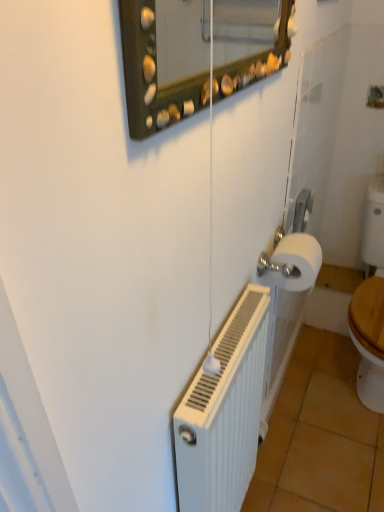
The image size is (384, 512). In order to click on white ribbed radiator at lower right in this screenshot , I will do `click(224, 413)`.

Describe the element at coordinates (224, 413) in the screenshot. I see `white ribbed radiator at lower right` at that location.

Image resolution: width=384 pixels, height=512 pixels. What do you see at coordinates (296, 262) in the screenshot? I see `white matte toilet paper at right` at bounding box center [296, 262].

The width and height of the screenshot is (384, 512). I want to click on white ribbed radiator at lower right, so click(x=224, y=413).

Does point (257, 473) appear closer or farther from the camera than point (269, 281)?

Point (257, 473) is positioned farther from the camera compared to point (269, 281).

From the image's perspective, does orange tile at lower right appear higher than white matte toilet paper at right?

Incorrect, from the image's perspective, orange tile at lower right is lower than white matte toilet paper at right.

Is orange tile at lower right behind white matte toilet paper at right?

Yes, orange tile at lower right is further from the viewer.

Consider the image. Is orange tile at lower right inside or outside of white matte toilet paper at right?

orange tile at lower right cannot be found inside white matte toilet paper at right.

Considering the sizes of objects white matte toilet paper at right and orange tile at lower right in the image provided, who is bigger, white matte toilet paper at right or orange tile at lower right?

With larger size is orange tile at lower right.

Is white matte toilet paper at right aimed at orange tile at lower right?

No, white matte toilet paper at right is not turned towards orange tile at lower right.

Does white matte toilet paper at right have a greater width compared to orange tile at lower right?

No.

From the image's perspective, is white matte toilet paper at right above or below orange tile at lower right?

Based on their image positions, white matte toilet paper at right is located above orange tile at lower right.

Is white ribbed radiator at lower right turned away from white matte toilet paper at right?

No, white ribbed radiator at lower right's orientation is not away from white matte toilet paper at right.

Identify the location of radiator that is under the white matte toilet paper at right (from a real-world perspective). The height and width of the screenshot is (512, 384). (224, 413).

From the image's perspective, is white ribbed radiator at lower right located above white matte toilet paper at right?

No, from the image's perspective, white ribbed radiator at lower right is not on top of white matte toilet paper at right.

Between white ribbed radiator at lower right and white matte toilet paper at right, which one has smaller size?

white matte toilet paper at right is smaller.

Considering the sizes of objects white ribbed radiator at lower right and orange tile at lower right in the image provided, who is thinner, white ribbed radiator at lower right or orange tile at lower right?

white ribbed radiator at lower right.

From a real-world perspective, is white ribbed radiator at lower right physically located above or below orange tile at lower right?

In terms of real-world spatial position, white ribbed radiator at lower right is above orange tile at lower right.

The height and width of the screenshot is (512, 384). In order to click on tile located below the white ribbed radiator at lower right (from the image's perspective) in this screenshot , I will do `click(320, 436)`.

Is white ribbed radiator at lower right outside of orange tile at lower right?

Yes, white ribbed radiator at lower right is located beyond the bounds of orange tile at lower right.

Based on the photo, is orange tile at lower right far from white ribbed radiator at lower right?

They are positioned close to each other.

From the image's perspective, which is below, orange tile at lower right or white ribbed radiator at lower right?

orange tile at lower right, from the image's perspective.

Is point (276, 504) less distant than point (262, 381)?

No, it is behind (262, 381).

Is white matte toilet paper at right turned away from white ribbed radiator at lower right?

No, white ribbed radiator at lower right is not at the back of white matte toilet paper at right.

Locate an element on the screen. The image size is (384, 512). radiator on the left side of white matte toilet paper at right is located at coordinates (224, 413).

Is white matte toilet paper at right to the left of white ribbed radiator at lower right from the viewer's perspective?

Incorrect, white matte toilet paper at right is not on the left side of white ribbed radiator at lower right.

From a real-world perspective, which object stands above the other?

white matte toilet paper at right.

This screenshot has width=384, height=512. What are the coordinates of `tile located underneath the white matte toilet paper at right (from a real-world perspective)` in the screenshot? It's located at (320, 436).

I want to click on toilet paper lying above the orange tile at lower right (from the image's perspective), so pos(296,262).

Which object lies further to the anchor point orange tile at lower right, white matte toilet paper at right or white ribbed radiator at lower right?

Among the two, white matte toilet paper at right is located further to orange tile at lower right.

Looking at the image, which one is located further to white matte toilet paper at right, white ribbed radiator at lower right or orange tile at lower right?

orange tile at lower right.

Which object lies nearer to the anchor point orange tile at lower right, white ribbed radiator at lower right or white matte toilet paper at right?

white ribbed radiator at lower right is positioned closer to the anchor orange tile at lower right.

Estimate the real-world distances between objects in this image. Which object is closer to white ribbed radiator at lower right, orange tile at lower right or white matte toilet paper at right?

Based on the image, white matte toilet paper at right appears to be nearer to white ribbed radiator at lower right.

Estimate the real-world distances between objects in this image. Which object is closer to white matte toilet paper at right, orange tile at lower right or white ribbed radiator at lower right?

white ribbed radiator at lower right is positioned closer to the anchor white matte toilet paper at right.

Which object lies nearer to the anchor point white ribbed radiator at lower right, white matte toilet paper at right or orange tile at lower right?

white matte toilet paper at right is closer to white ribbed radiator at lower right.

You are a GUI agent. You are given a task and a screenshot of the screen. Output one action in this format:
    pyautogui.click(x=<x>, y=<y>)
    Task: Click on the radiator between white matte toilet paper at right and orange tile at lower right in the up-down direction
    The image size is (384, 512).
    Given the screenshot: What is the action you would take?
    pyautogui.click(x=224, y=413)